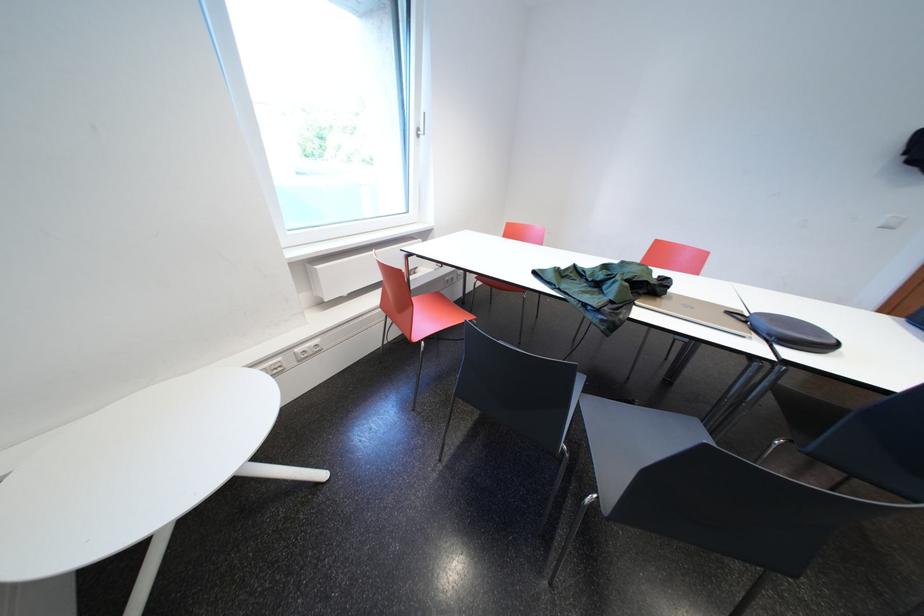
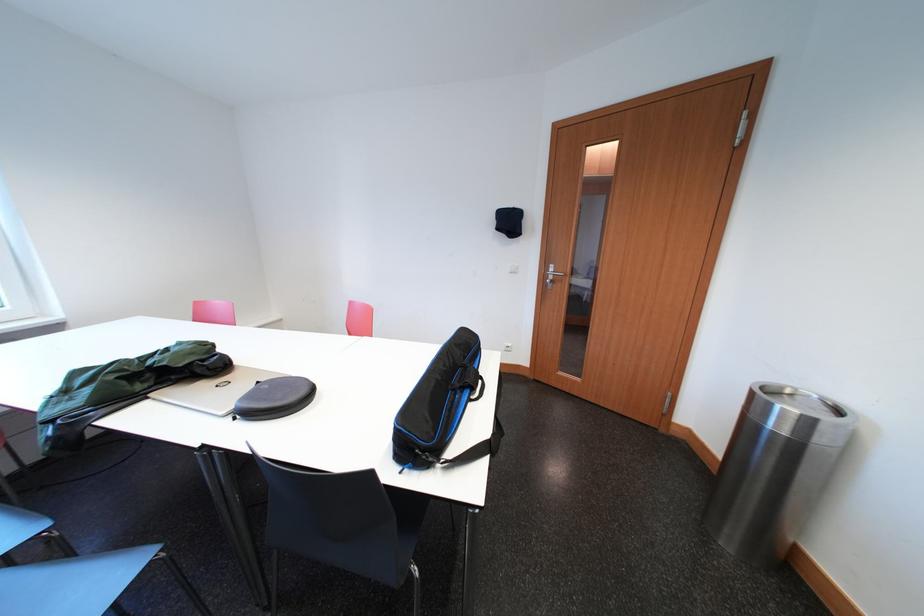
Question: The images are taken continuously from a first-person perspective. In which direction are you moving?

Choices:
 (A) Left
 (B) Right
 (C) Forward
 (D) Backward

Answer: (B)